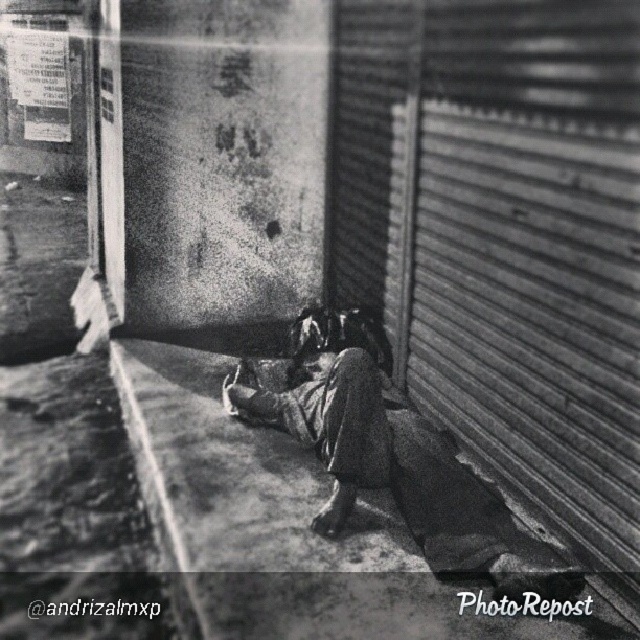
Between metallic corrugated at right and smooth concrete curb at lower left, which one appears on the right side from the viewer's perspective?

Positioned to the right is metallic corrugated at right.

Who is more forward, (484, 356) or (141, 481)?

→ Positioned in front is point (484, 356).

The height and width of the screenshot is (640, 640). What are the coordinates of `metallic corrugated at right` in the screenshot? It's located at (532, 308).

This screenshot has height=640, width=640. Identify the location of metallic corrugated at right. (532, 308).

Is ragged fabric woman at center to the right of smooth concrete curb at lower left from the viewer's perspective?

Yes, ragged fabric woman at center is to the right of smooth concrete curb at lower left.

Measure the distance from ragged fabric woman at center to smooth concrete curb at lower left.

ragged fabric woman at center and smooth concrete curb at lower left are 3.81 feet apart from each other.

I want to click on ragged fabric woman at center, so click(x=390, y=452).

This screenshot has width=640, height=640. In order to click on ragged fabric woman at center in this screenshot , I will do `click(390, 452)`.

Who is lower down, metallic corrugated at right or ragged fabric woman at center?

ragged fabric woman at center is lower down.

The width and height of the screenshot is (640, 640). What are the coordinates of `metallic corrugated at right` in the screenshot? It's located at (532, 308).